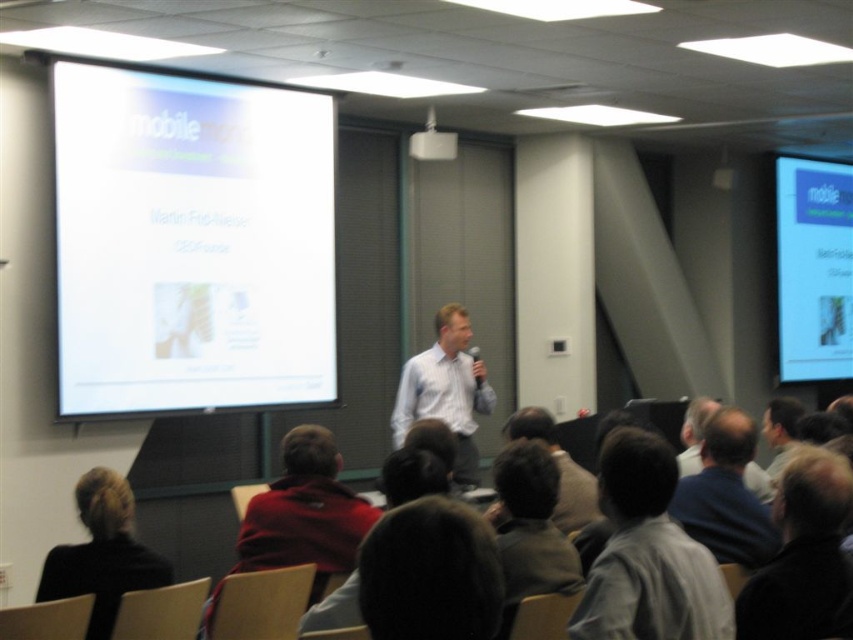
From the picture: You are an attendee at the presentation. You notice the dark brown hair at lower center and the black sweater at lower left. Which one is positioned higher in the image?

The dark brown hair at lower center is positioned higher than the black sweater at lower left.

You are an event organizer who needs to adjust seating arrangements. You see the dark brown hair at lower center and the black sweater at lower left in the front row. Which object takes up more space in the image?

The black sweater at lower left occupies more space than the dark brown hair at lower center.

You are an attendee at the presentation. You want to take a photo of the slide on the matte white projector screen at upper right but notice the dark blue shirt at lower right is blocking your view. Can you move around to the left side of the room to get a clear shot?

The dark blue shirt at lower right is behind the matte white projector screen at upper right, so moving to the left side of the room would position you to the side of the screen where the dark blue shirt at lower right is not obstructing the view, allowing you to take a clear photo.